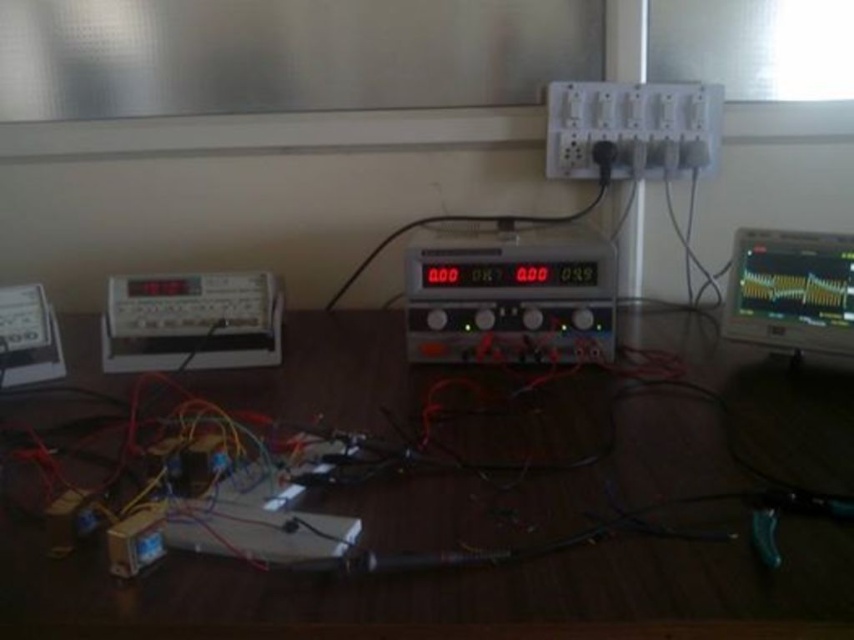
You are setting up an experiment and need to place a 15 cm tall component on the wooden table at center. The matte gray digital meter at left is already placed on the table. Can the component be placed on the table without it exceeding the table height?

The wooden table at center has a greater height compared to the matte gray digital meter at left. Since the table is taller than the meter, placing a 15 cm tall component on the table would not exceed the table height as long as the component itself doesn

You are a technician standing 4 feet away from the black plastic multimeter at center. Can you reach it without moving your position?

The black plastic multimeter at center is 3.99 feet from viewer, so yes, you can reach it since you are standing exactly 4 feet away.

You are an engineer working on this setup. You need to place a new component that requires 10 cm of clearance. Given the height difference between the black plastic multimeter at center and the matte black monitor at right, which object should you place it next to to ensure enough space?

The black plastic multimeter at center is taller than the matte black monitor at right, so you should place the component next to the matte black monitor at right to ensure sufficient clearance.